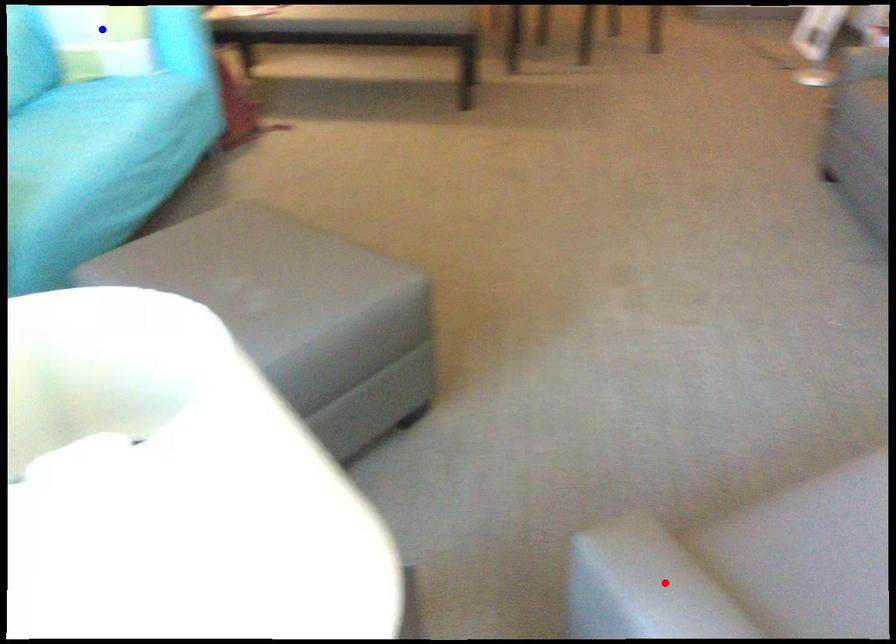
Question: Which of the two points in the image is closer to the camera?

Choices:
 (A) Blue point is closer.
 (B) Red point is closer.

Answer: (B)